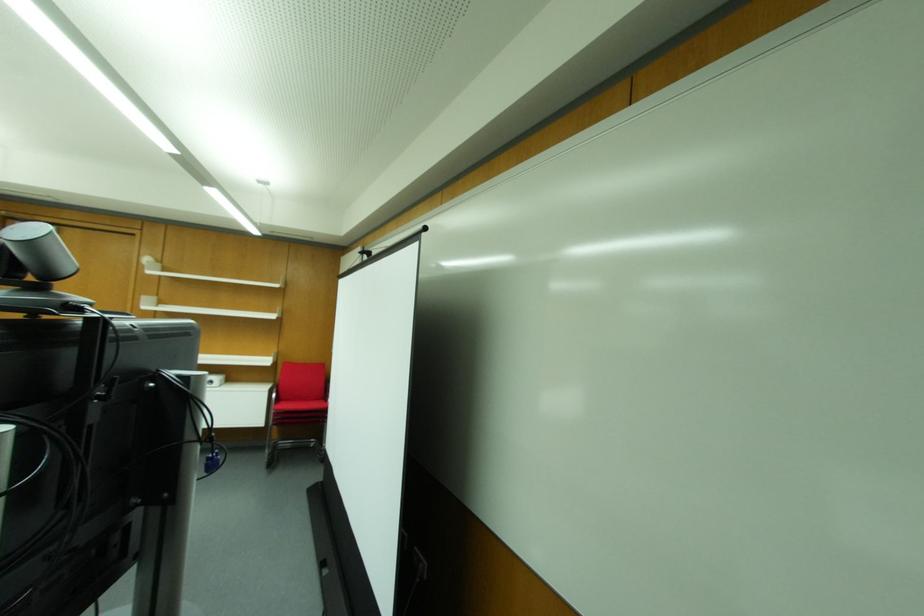
Describe the element at coordinates (299, 405) in the screenshot. This screenshot has height=616, width=924. I see `the red chair sitting surface` at that location.